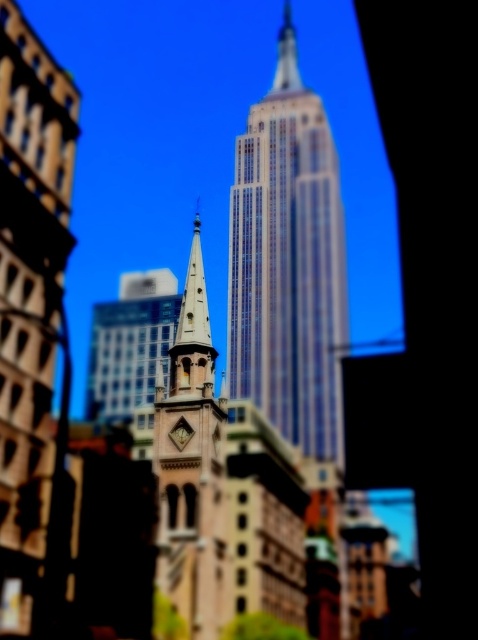
Which is in front, point (341, 464) or point (217, 593)?

Point (217, 593)

The height and width of the screenshot is (640, 478). In order to click on glassy steel skyscraper at center in this screenshot , I will do `click(288, 262)`.

Does smooth glass tower at center appear on the left side of beige stone clock tower at center?

Yes, smooth glass tower at center is to the left of beige stone clock tower at center.

Is point (21, 628) positioned behind point (160, 509)?

That is False.

Locate an element on the screen. smooth glass tower at center is located at coordinates (30, 300).

At what (x,y) coordinates should I click in order to perform the action: click on smooth glass tower at center. Please return your answer as a coordinate pair (x, y). The width and height of the screenshot is (478, 640). Looking at the image, I should click on (30, 300).

Which of these two, glassy steel skyscraper at center or smooth glass tower at center, stands taller?

With more height is glassy steel skyscraper at center.

Between glassy steel skyscraper at center and smooth glass tower at center, which one appears on the right side from the viewer's perspective?

From the viewer's perspective, glassy steel skyscraper at center appears more on the right side.

Who is more forward, (271, 236) or (9, 609)?

Point (9, 609)

The image size is (478, 640). I want to click on glassy steel skyscraper at center, so click(288, 262).